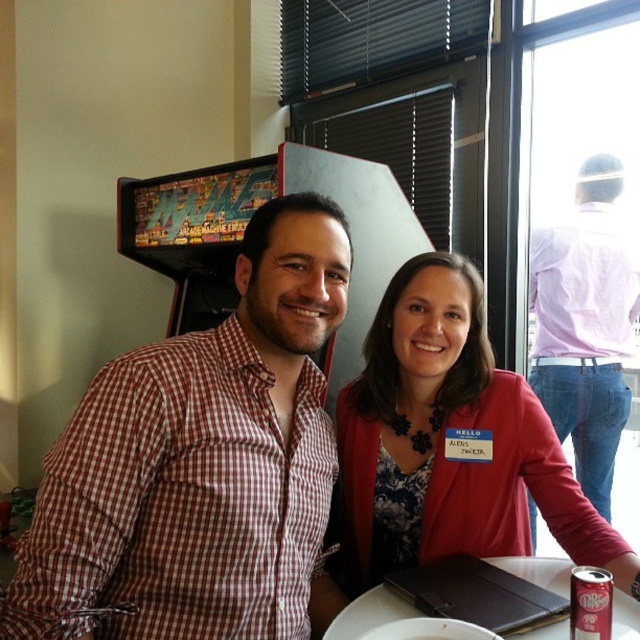
Question: Among these objects, which one is farthest from the camera?

Choices:
 (A) matte pink blazer at center
 (B) checkered fabric shirt at center

Answer: (A)

Question: Can you confirm if checkered fabric shirt at center is positioned to the left of white glossy plate at center?

Choices:
 (A) yes
 (B) no

Answer: (A)

Question: Is the position of checkered fabric shirt at center more distant than that of matte pink blazer at center?

Choices:
 (A) yes
 (B) no

Answer: (B)

Question: Which point is closer to the camera taking this photo?

Choices:
 (A) (172, 355)
 (B) (353, 614)

Answer: (A)

Question: Can you confirm if checkered fabric shirt at center is positioned to the right of matte pink blazer at center?

Choices:
 (A) yes
 (B) no

Answer: (B)

Question: Among these points, which one is farthest from the camera?

Choices:
 (A) (406, 412)
 (B) (177, 625)

Answer: (A)